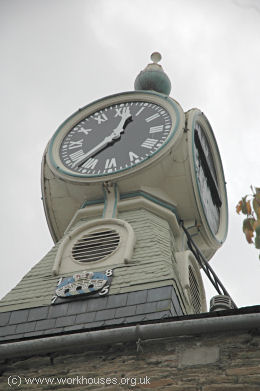
Where is `clock`? This screenshot has width=260, height=391. clock is located at coordinates (165, 153).